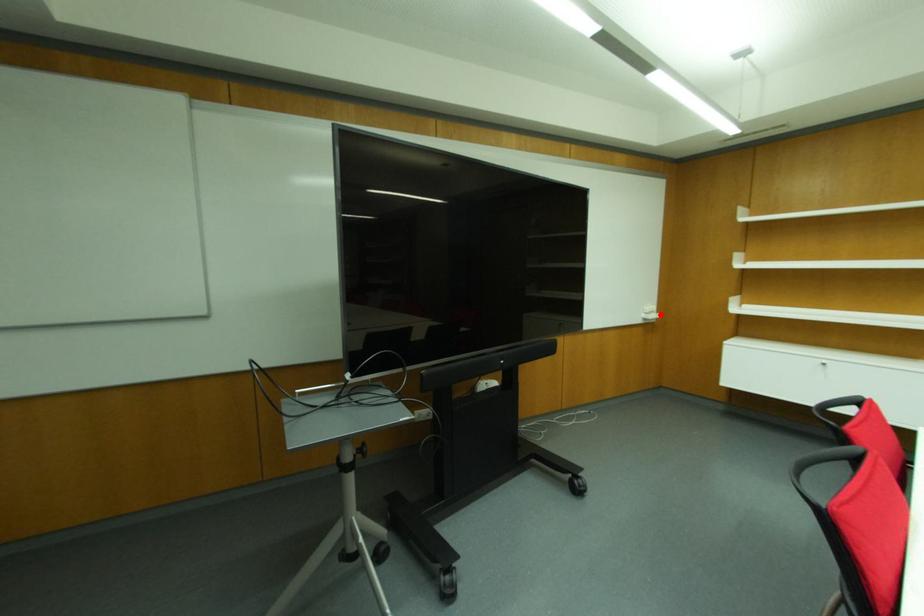
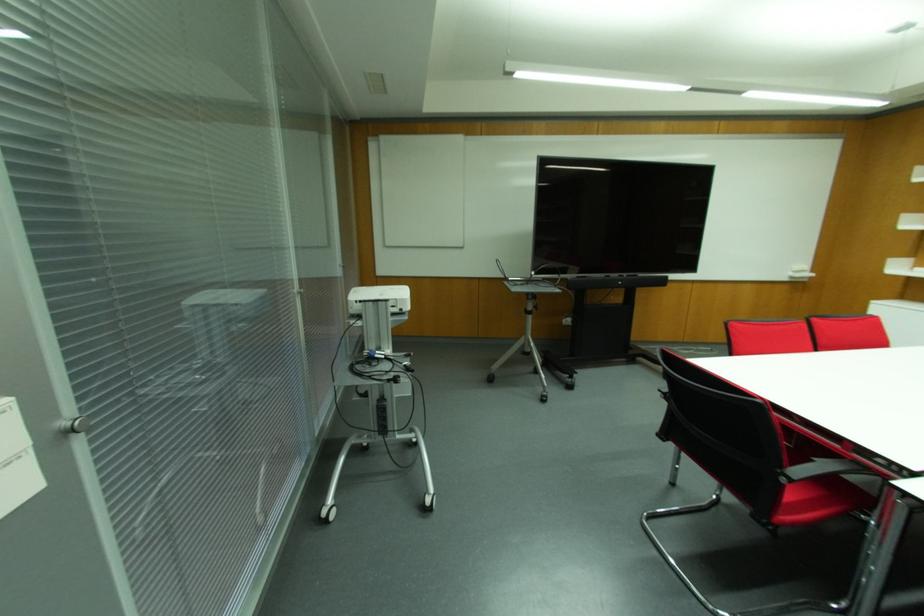
Question: I am providing you with two images of the same scene from different viewpoints. A red point is shown in image1. For the corresponding object point in image2, is it positioned nearer or farther from the camera?

Choices:
 (A) Nearer
 (B) Farther

Answer: (B)